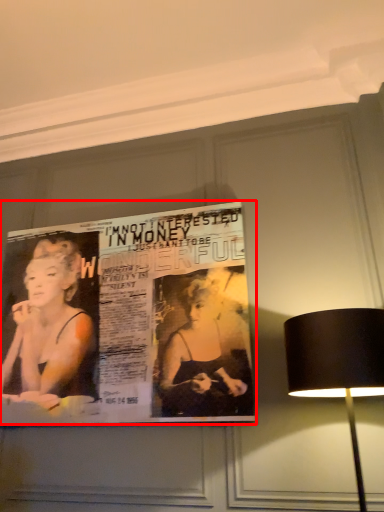
Question: Considering the relative positions of poster (annotated by the red box) and lamp in the image provided, where is poster (annotated by the red box) located with respect to the staircase?

Choices:
 (A) right
 (B) left

Answer: (B)